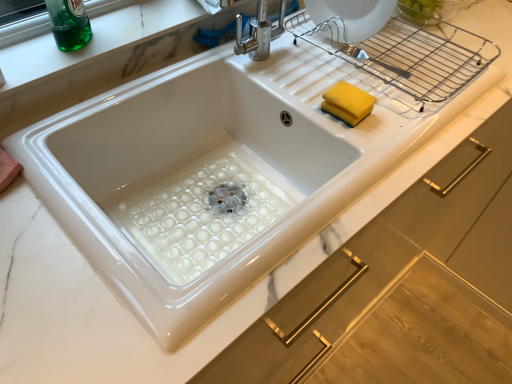
Identify the location of unoccupied area behind yellow sponge at upper right. The image size is (512, 384). (338, 71).